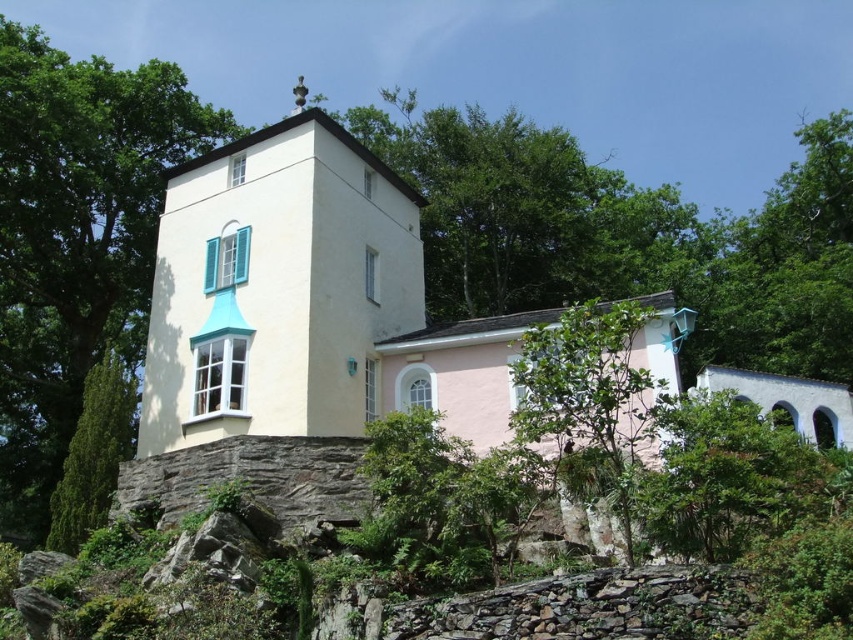
Question: Can you confirm if green leafy tree at center is bigger than green leafy tree at lower left?

Choices:
 (A) no
 (B) yes

Answer: (A)

Question: Does white smooth stone chapel at center have a lesser width compared to green leafy tree at center?

Choices:
 (A) no
 (B) yes

Answer: (A)

Question: Which point appears closest to the camera in this image?

Choices:
 (A) (91, 422)
 (B) (120, 316)

Answer: (A)

Question: Does white smooth stone chapel at center appear over green leafy tree at left?

Choices:
 (A) no
 (B) yes

Answer: (A)

Question: Which point is farther to the camera?

Choices:
 (A) green leafy tree at center
 (B) green leafy tree at lower left
 (C) white smooth stone chapel at center
 (D) green leafy tree at left

Answer: (D)

Question: Among these objects, which one is farthest from the camera?

Choices:
 (A) white smooth stone chapel at center
 (B) green leafy tree at lower left
 (C) green leafy tree at left
 (D) green leafy tree at center

Answer: (C)